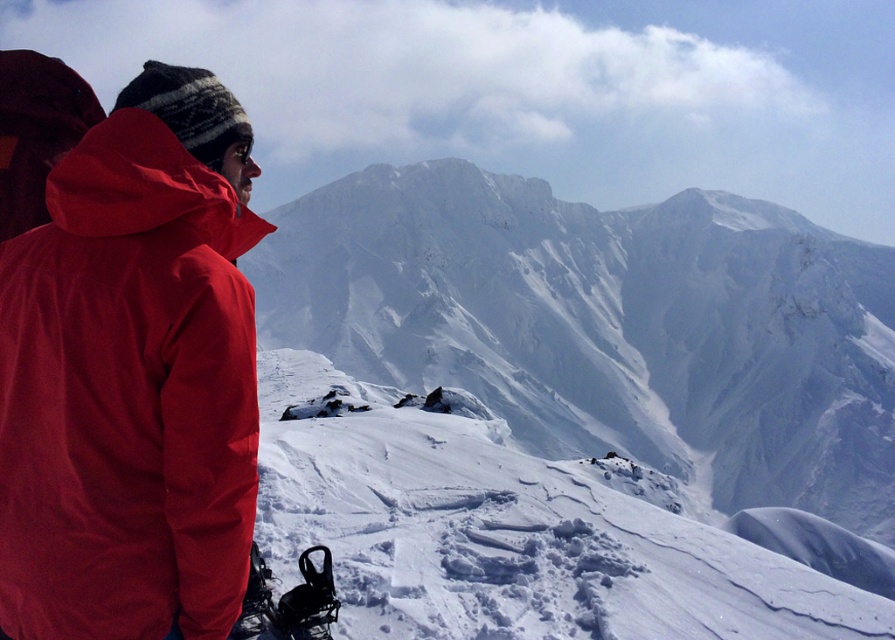
Question: Among these points, which one is nearest to the camera?

Choices:
 (A) (x=505, y=196)
 (B) (x=308, y=362)

Answer: (B)

Question: From the image, what is the correct spatial relationship of white snow-covered mountain at center in relation to matte red jacket at left?

Choices:
 (A) left
 (B) right

Answer: (B)

Question: Does matte red jacket at left come behind white powdery snow at center?

Choices:
 (A) yes
 (B) no

Answer: (B)

Question: Is matte red jacket at left closer to the viewer compared to white powdery snow at center?

Choices:
 (A) yes
 (B) no

Answer: (A)

Question: Which object is farther from the camera taking this photo?

Choices:
 (A) white snow-covered mountain at center
 (B) white powdery snow at center

Answer: (A)

Question: Which object appears farthest from the camera in this image?

Choices:
 (A) matte red jacket at left
 (B) white snow-covered mountain at center
 (C) white powdery snow at center

Answer: (B)